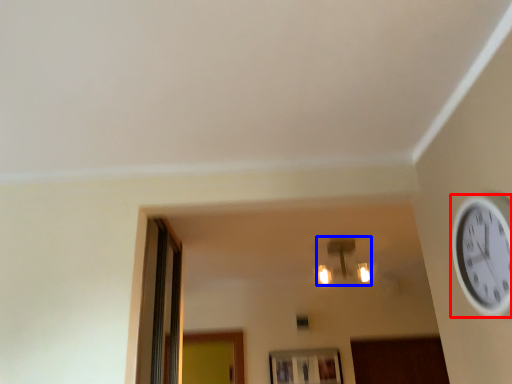
Question: Which of the following is the closest to the observer, wall clock (highlighted by a red box) or light fixture (highlighted by a blue box)?

Choices:
 (A) wall clock
 (B) light fixture

Answer: (A)